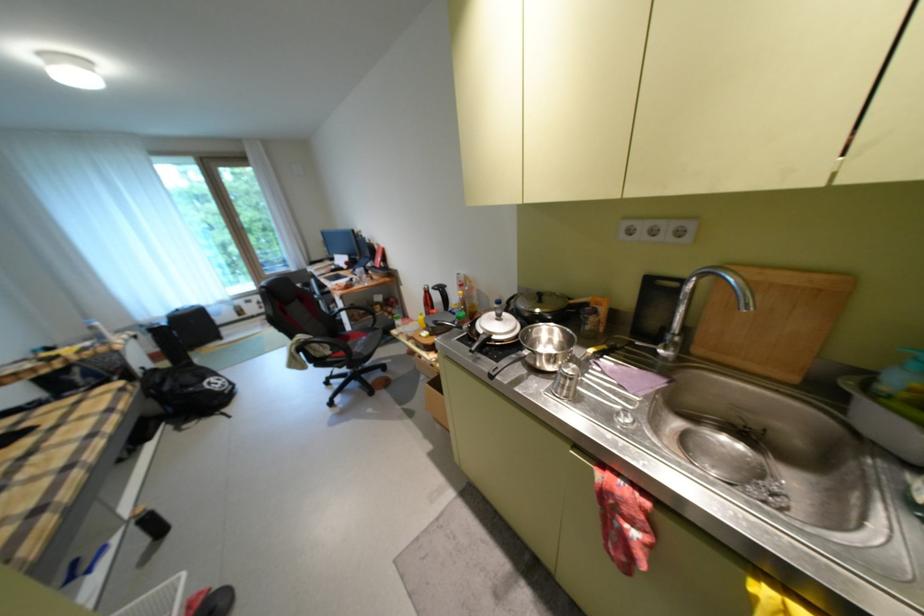
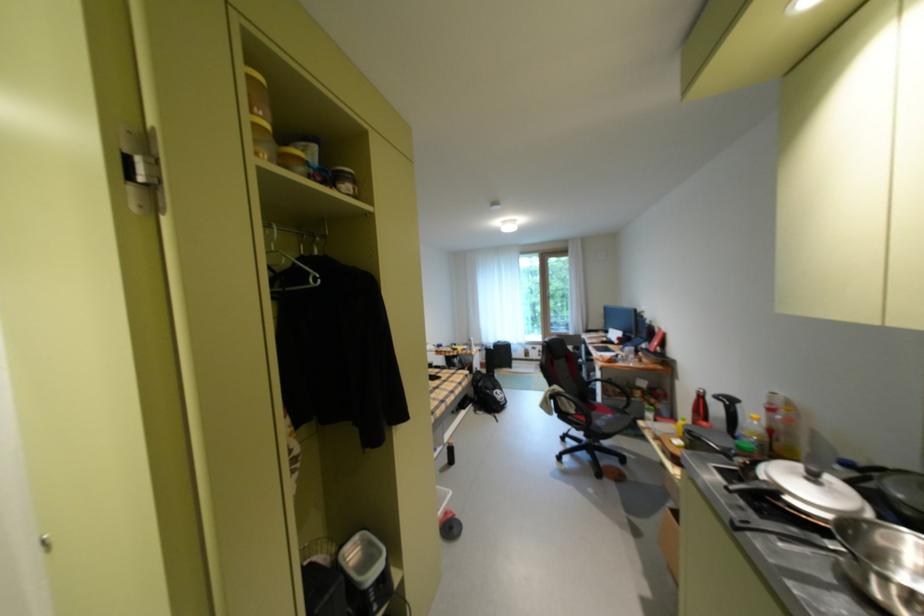
In the second image, find the point that corresponds to (438,291) in the first image.

(712, 395)